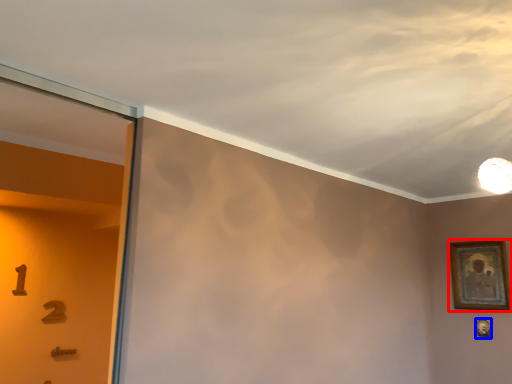
Question: Among these objects, which one is farthest to the camera, picture frame (highlighted by a red box) or picture frame (highlighted by a blue box)?

Choices:
 (A) picture frame
 (B) picture frame

Answer: (B)